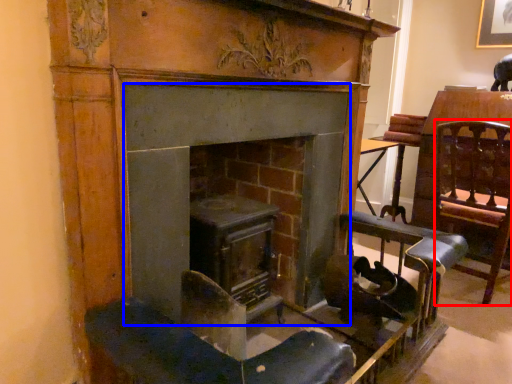
Question: Which of the following is the farthest to the observer, swivel chair (highlighted by a red box) or fireplace (highlighted by a blue box)?

Choices:
 (A) swivel chair
 (B) fireplace

Answer: (A)